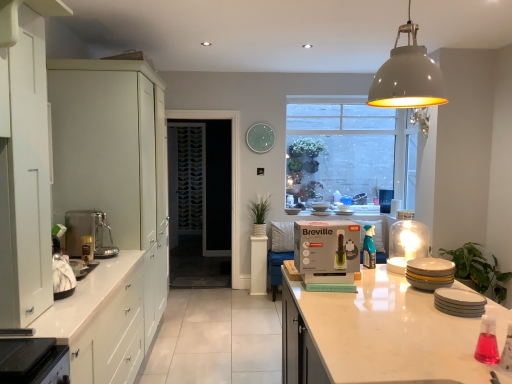
Question: Looking at the image, does translucent glass dome at upper right, marked as the 3th appliance in a front-to-back arrangement, seem bigger or smaller compared to matte gray dome at upper center?

Choices:
 (A) small
 (B) big

Answer: (A)

Question: Is translucent glass dome at upper right, acting as the first appliance starting from the back, inside or outside of matte gray dome at upper center?

Choices:
 (A) inside
 (B) outside

Answer: (B)

Question: Based on their relative distances, which object is nearer to the satin silver coffee machine at left?

Choices:
 (A) white glossy countertop at lower center, positioned as the 1th countertop in right-to-left order
 (B) white glossy plates at right, which is the first appliance in front-to-back order
 (C) clear glass window at upper center
 (D) white matte cabinet at left, placed as the 1th cabinetry when sorted from front to back
 (E) green matte plant at center, which is the first plant from back to front

Answer: (D)

Question: Estimate the real-world distances between objects in this image. Which object is farther from the translucent plastic spray bottle at center?

Choices:
 (A) patterned glass screen door at center
 (B) white matte cabinet at left, acting as the second cabinetry starting from the back
 (C) white glossy plates at right, which is the first appliance in front-to-back order
 (D) green leafy plant at right, the second plant when ordered from back to front
 (E) green matte plant at center, marked as the 2th plant in a bottom-to-top arrangement

Answer: (A)